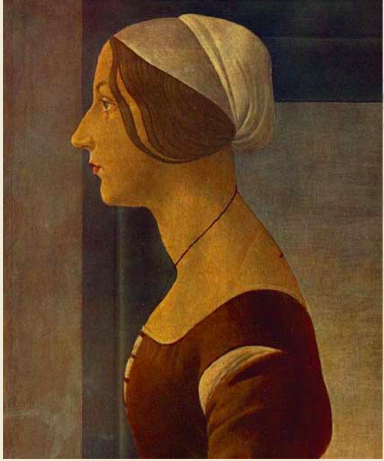
The width and height of the screenshot is (384, 461). I want to click on grey wall, so click(x=68, y=386).